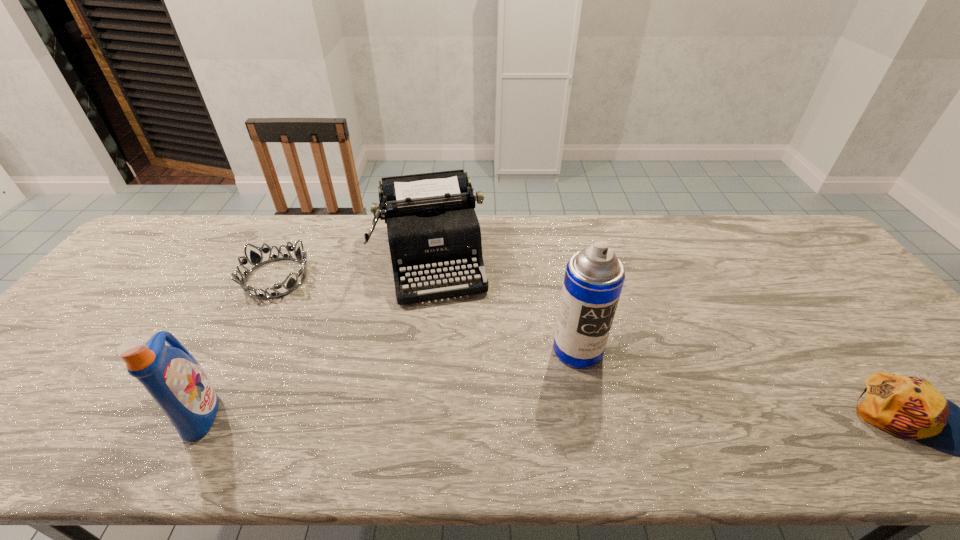
Where is `free spot at the near edge of the desktop`? free spot at the near edge of the desktop is located at coordinates (239, 399).

Where is `vacant space at the left edge of the desktop`? This screenshot has width=960, height=540. vacant space at the left edge of the desktop is located at coordinates (83, 338).

You are a GUI agent. You are given a task and a screenshot of the screen. Output one action in this format:
    pyautogui.click(x=<x>, y=<y>)
    Task: Click on the vacant area at the right edge
    The width and height of the screenshot is (960, 540).
    Given the screenshot: What is the action you would take?
    pyautogui.click(x=845, y=291)

In the image, there is a desktop. At what (x,y) coordinates should I click in order to perform the action: click on free region at the far left corner. Please return your answer as a coordinate pair (x, y). The image size is (960, 540). Looking at the image, I should click on (193, 222).

Locate an element on the screen. free space between the tallest object and the typewriter is located at coordinates (505, 304).

Find the location of a particular element. The image size is (960, 540). free point between the third shortest object and the fourth shortest object is located at coordinates (317, 335).

This screenshot has width=960, height=540. Identify the location of unoccupied position between the third shortest object and the second object from right to left. (505, 304).

The width and height of the screenshot is (960, 540). I want to click on unoccupied position between the tiara and the detergent, so click(238, 345).

At what (x,y) coordinates should I click in order to perform the action: click on vacant area between the aerosol can and the detergent. Please return your answer as a coordinate pair (x, y). Looking at the image, I should click on (390, 381).

Where is `object that is the closest to the cap`? The width and height of the screenshot is (960, 540). object that is the closest to the cap is located at coordinates (594, 277).